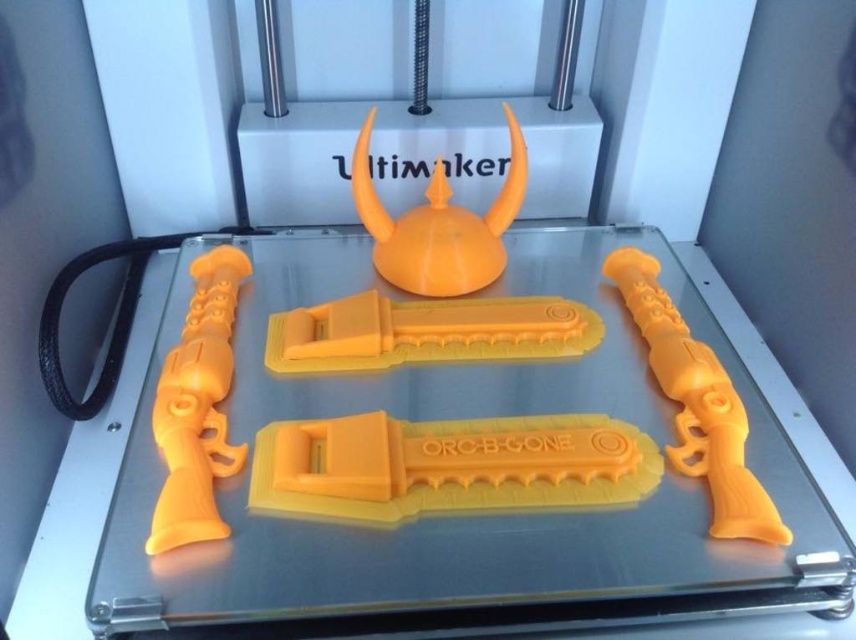
Question: Does yellow matte/orange plastic knife at center have a smaller size compared to translucent yellow plastic glass table at center?

Choices:
 (A) yes
 (B) no

Answer: (A)

Question: Which point is farther from the camera taking this photo?

Choices:
 (A) (384, 451)
 (B) (179, 406)
 (C) (822, 621)

Answer: (B)

Question: Is translucent yellow plastic glass table at center to the right of matte orange gun at left from the viewer's perspective?

Choices:
 (A) no
 (B) yes

Answer: (A)

Question: Which object is closer to the camera taking this photo?

Choices:
 (A) orange matte helmet at center
 (B) yellow matte plastic sword at center
 (C) matte orange gun at left
 (D) translucent yellow plastic glass table at center

Answer: (C)

Question: Is yellow matte/orange plastic knife at center below yellow matte plastic sword at center?

Choices:
 (A) no
 (B) yes

Answer: (B)

Question: Which object is positioned closest to the yellow matte plastic revolver at right?

Choices:
 (A) yellow matte/orange plastic knife at center
 (B) translucent yellow plastic glass table at center

Answer: (A)